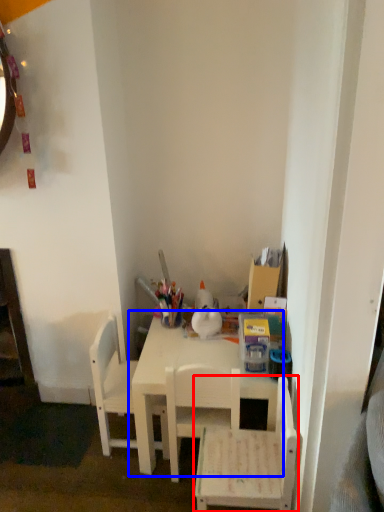
Question: Which point is further to the camera, chair (highlighted by a red box) or table (highlighted by a blue box)?

Choices:
 (A) chair
 (B) table

Answer: (B)